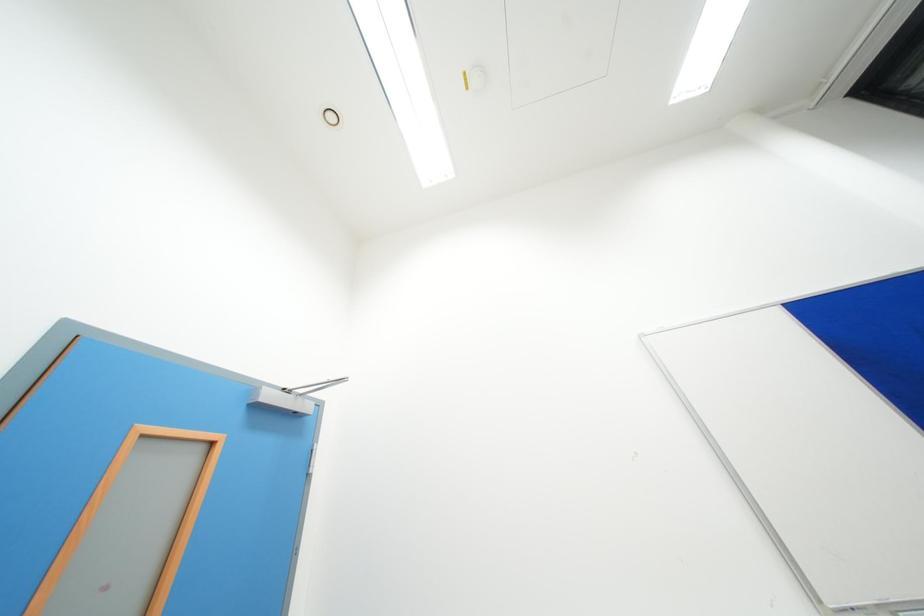
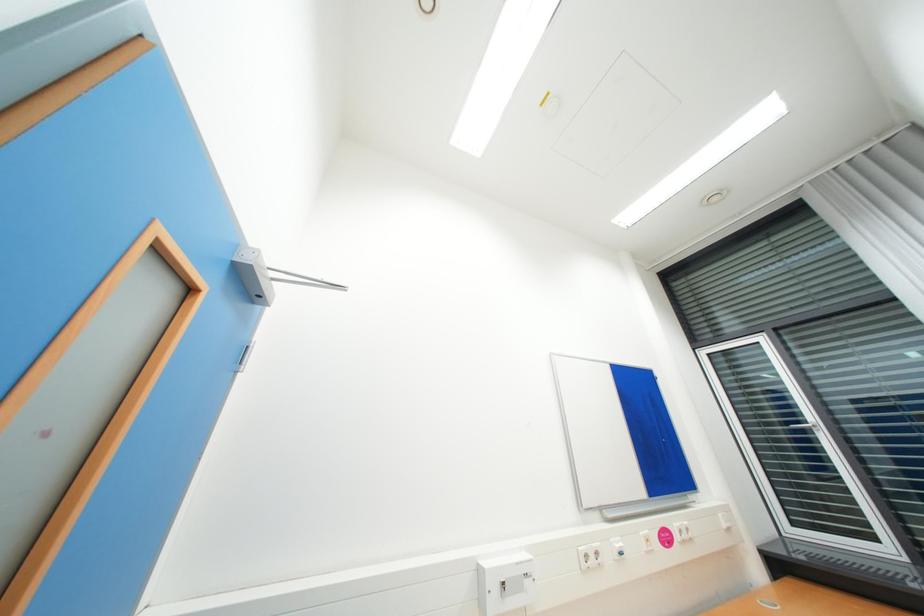
Question: The camera is either moving clockwise (left) or counter-clockwise (right) around the object. The first image is from the beginning of the video and the second image is from the end. Is the camera moving left or right when shooting the video?

Choices:
 (A) Left
 (B) Right

Answer: (A)